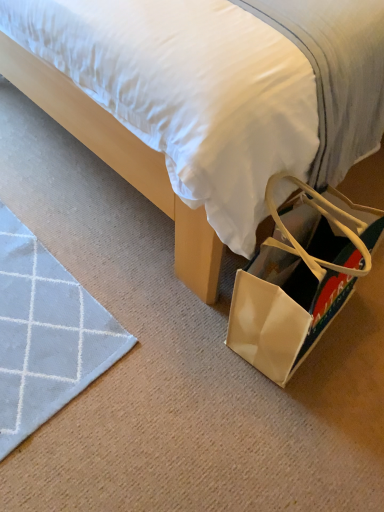
Question: Is white fabric bed at center surrounding matte beige shoulder bag at lower right?

Choices:
 (A) yes
 (B) no

Answer: (B)

Question: Is the position of white fabric bed at center less distant than that of matte beige shoulder bag at lower right?

Choices:
 (A) no
 (B) yes

Answer: (B)

Question: From the image's perspective, is white fabric bed at center on matte beige shoulder bag at lower right?

Choices:
 (A) yes
 (B) no

Answer: (A)

Question: Does white fabric bed at center have a smaller size compared to matte beige shoulder bag at lower right?

Choices:
 (A) no
 (B) yes

Answer: (A)

Question: Is white fabric bed at center thinner than matte beige shoulder bag at lower right?

Choices:
 (A) yes
 (B) no

Answer: (B)

Question: Is white fabric bed at center positioned with its back to matte beige shoulder bag at lower right?

Choices:
 (A) yes
 (B) no

Answer: (B)

Question: Is matte beige shoulder bag at lower right wider than white fabric bed at center?

Choices:
 (A) yes
 (B) no

Answer: (B)

Question: Does matte beige shoulder bag at lower right appear on the right side of white fabric bed at center?

Choices:
 (A) no
 (B) yes

Answer: (B)

Question: Is matte beige shoulder bag at lower right positioned beyond the bounds of white fabric bed at center?

Choices:
 (A) no
 (B) yes

Answer: (B)

Question: Is matte beige shoulder bag at lower right to the left of white fabric bed at center from the viewer's perspective?

Choices:
 (A) yes
 (B) no

Answer: (B)

Question: Is matte beige shoulder bag at lower right oriented away from white fabric bed at center?

Choices:
 (A) no
 (B) yes

Answer: (A)

Question: Is the depth of matte beige shoulder bag at lower right less than that of white fabric bed at center?

Choices:
 (A) no
 (B) yes

Answer: (A)

Question: Is matte beige shoulder bag at lower right taller or shorter than white fabric bed at center?

Choices:
 (A) short
 (B) tall

Answer: (A)